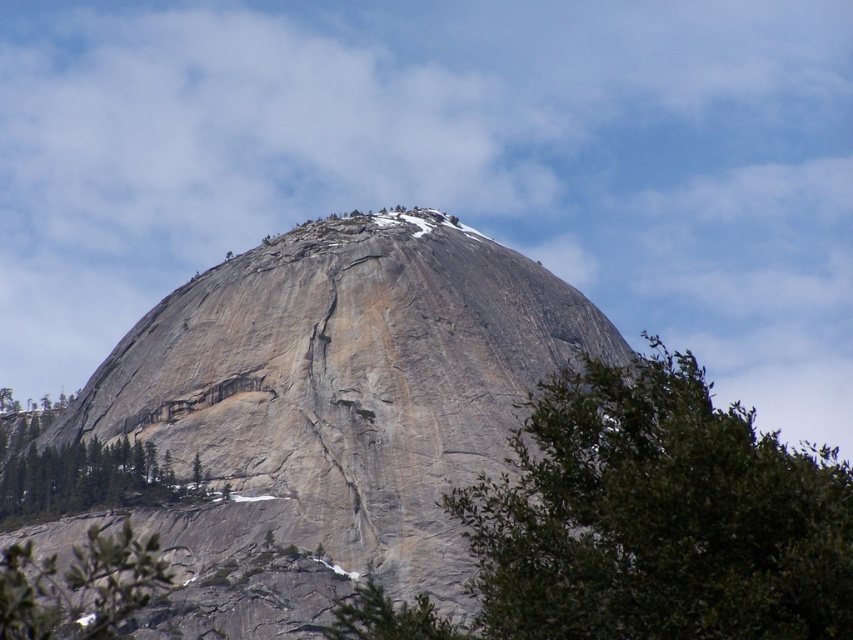
You are a hiker planning to climb the gray rock formation at center and the green leafy tree at center. Which one is higher up the mountain?

The gray rock formation at center is positioned over the green leafy tree at center, so the gray rock formation at center is higher up the mountain than the green leafy tree at center.

In the scene shown: You are a hiker standing at the base of the granite rock formation and looking up. You see two green trees at the lower left of the scene. Which tree is closer to you, the green textured tree at lower left or the green leafy tree at lower left?

The green textured tree at lower left is closer to you because it is further to the viewer than the green leafy tree at lower left.